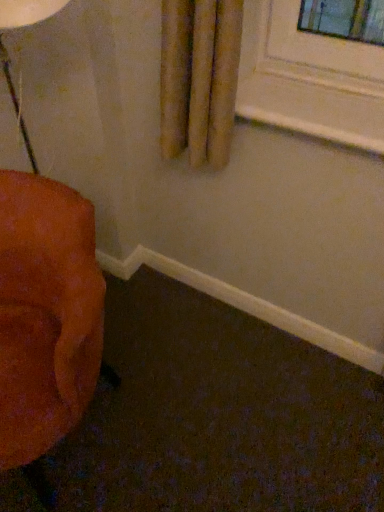
Question: Based on their positions, is white painted wood at upper center located to the left or right of velvet orange chair at left?

Choices:
 (A) right
 (B) left

Answer: (A)

Question: Do you think white painted wood at upper center is within velvet orange chair at left, or outside of it?

Choices:
 (A) outside
 (B) inside

Answer: (A)

Question: Based on their sizes in the image, would you say white painted wood at upper center is bigger or smaller than velvet orange chair at left?

Choices:
 (A) big
 (B) small

Answer: (B)

Question: From their relative heights in the image, would you say velvet orange chair at left is taller or shorter than white painted wood at upper center?

Choices:
 (A) tall
 (B) short

Answer: (A)

Question: From a real-world perspective, is velvet orange chair at left above or below white painted wood at upper center?

Choices:
 (A) above
 (B) below

Answer: (B)

Question: Looking at their shapes, would you say velvet orange chair at left is wider or thinner than white painted wood at upper center?

Choices:
 (A) wide
 (B) thin

Answer: (A)

Question: Considering the relative positions of velvet orange chair at left and white painted wood at upper center in the image provided, is velvet orange chair at left to the left or to the right of white painted wood at upper center?

Choices:
 (A) right
 (B) left

Answer: (B)